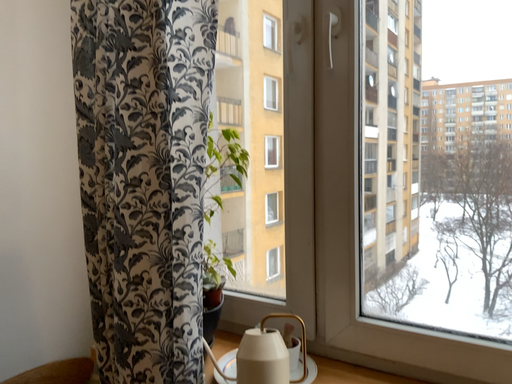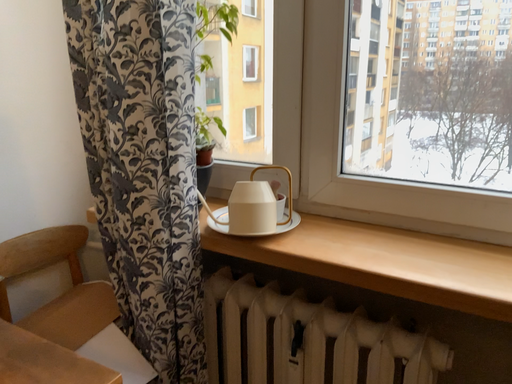
Question: Which way did the camera rotate in the video?

Choices:
 (A) rotated upward
 (B) rotated downward

Answer: (B)